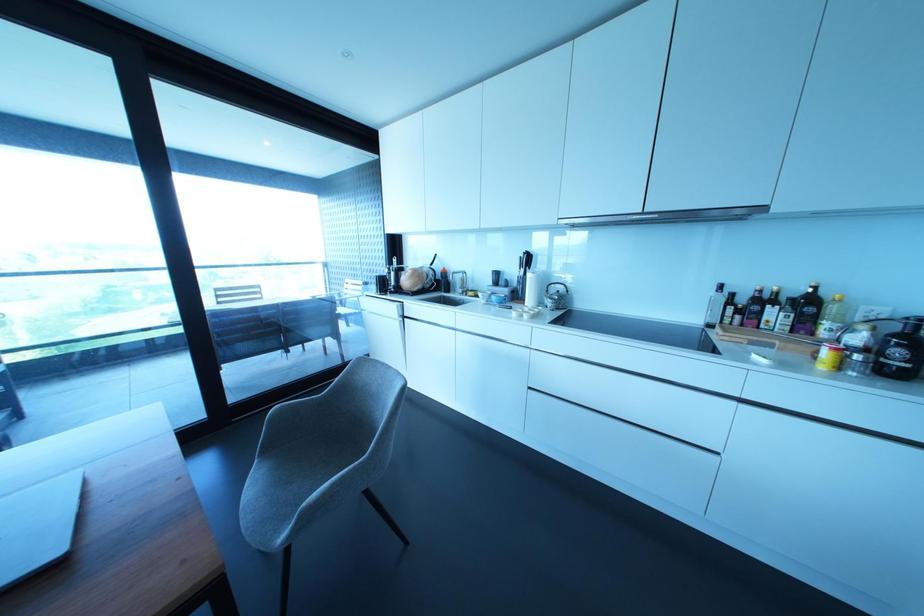
Identify the location of chair armrest. (299, 400).